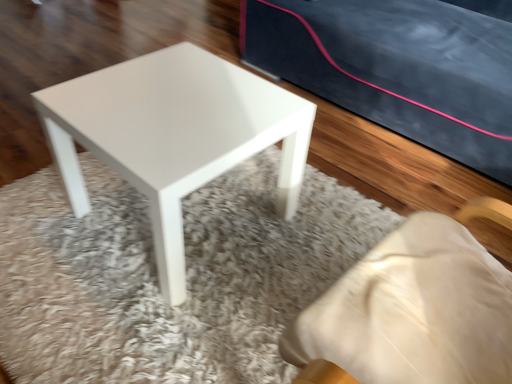
This screenshot has height=384, width=512. In order to click on vacant space in front of white glossy stool at center in this screenshot , I will do `click(146, 317)`.